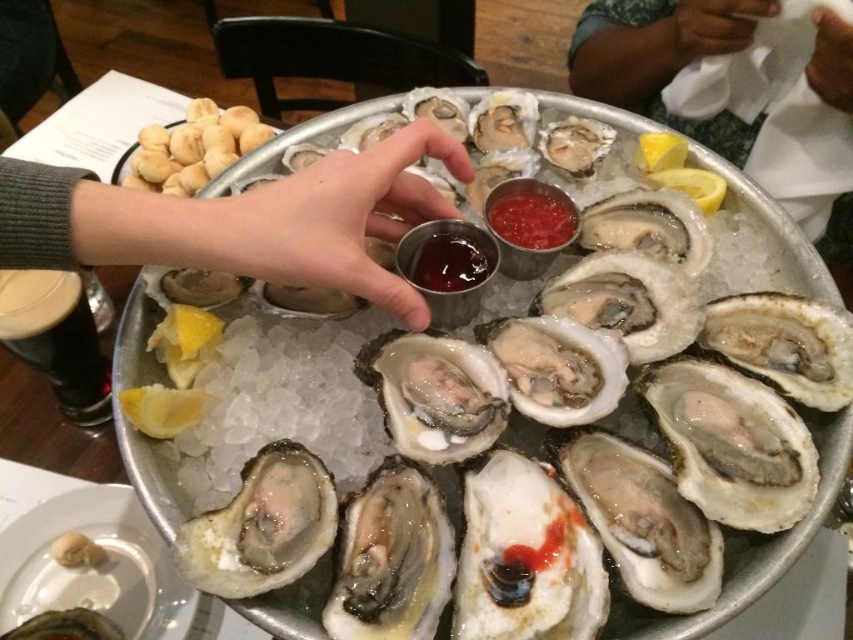
Question: From the image, what is the correct spatial relationship of gray woolen sweater at upper left in relation to yellow matte lemon at upper right?

Choices:
 (A) above
 (B) below

Answer: (B)

Question: Can you confirm if gray woolen sweater at upper left is thinner than yellow matte lemon at upper right?

Choices:
 (A) yes
 (B) no

Answer: (B)

Question: Which object is the farthest from the yellow matte lemon at upper right?

Choices:
 (A) dark skin tone at upper right
 (B) yellow matte lemon at lower left

Answer: (B)

Question: Which object appears farthest from the camera in this image?

Choices:
 (A) shiny silver oyster shells at center
 (B) yellow matte lemon at lower left
 (C) gray woolen sweater at upper left
 (D) yellow matte lemon at upper right

Answer: (D)

Question: Which object is farther from the camera taking this photo?

Choices:
 (A) gray woolen sweater at upper left
 (B) yellow matte lemon at lower left
 (C) yellow matte lemon at upper right

Answer: (C)

Question: Considering the relative positions of shiny silver oyster shells at center and yellow matte lemon at upper right in the image provided, where is shiny silver oyster shells at center located with respect to yellow matte lemon at upper right?

Choices:
 (A) below
 (B) above

Answer: (A)